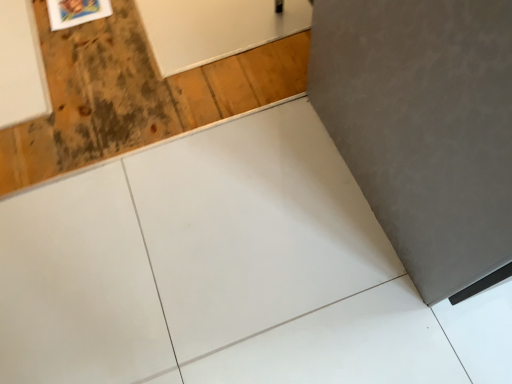
The height and width of the screenshot is (384, 512). What are the coordinates of `free spot in front of wooden frame at upper left` in the screenshot? It's located at (77, 48).